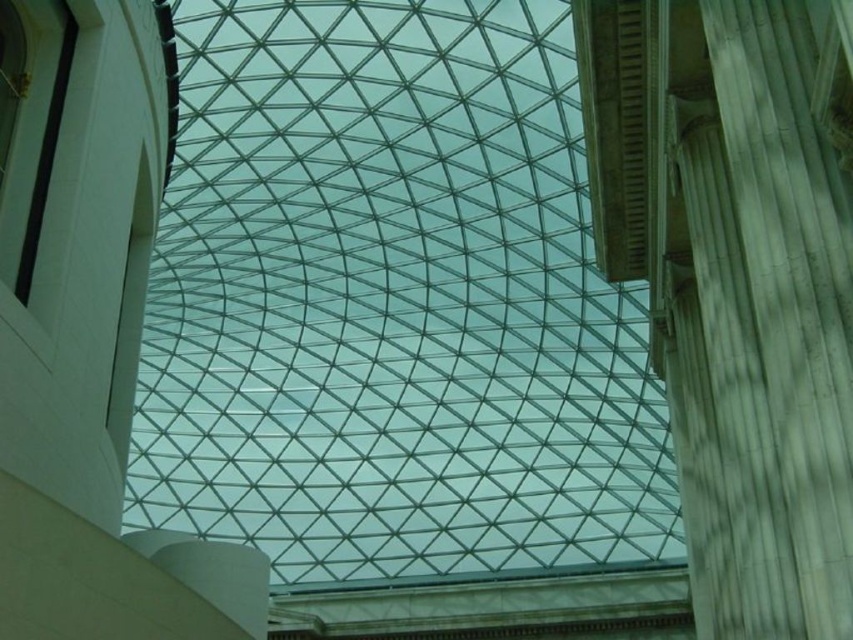
You are an architect designing a new building and want to ensure structural integrity. Given the transparent glass roof at center and the white marble pillar at right, which object is positioned in a way that might affect the load distribution of the building?

The transparent glass roof at center is below the white marble pillar at right, meaning the pillar is above the roof. This placement could affect the load distribution as the pillar may be bearing weight onto the roof structure.

You are an architect planning to install a new lighting fixture that requires a 30 meter cable. You need to place it between the transparent glass roof at center and the white marble pillar at right. Will the cable be long enough to reach from one to the other?

The transparent glass roof at center is 31.40 meters from the white marble pillar at right. Since the cable is only 30 meters long, it will not be long enough to reach between the transparent glass roof at center and the white marble pillar at right.